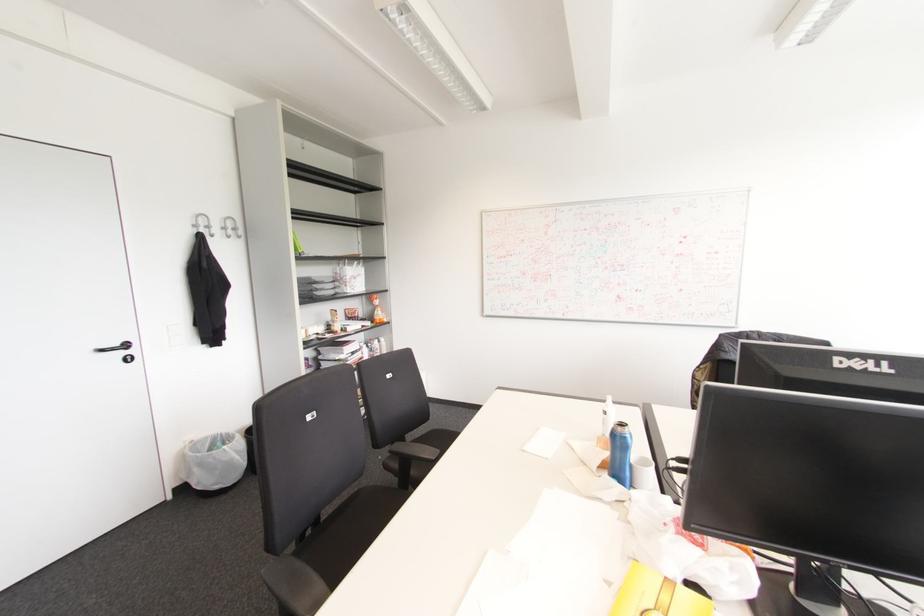
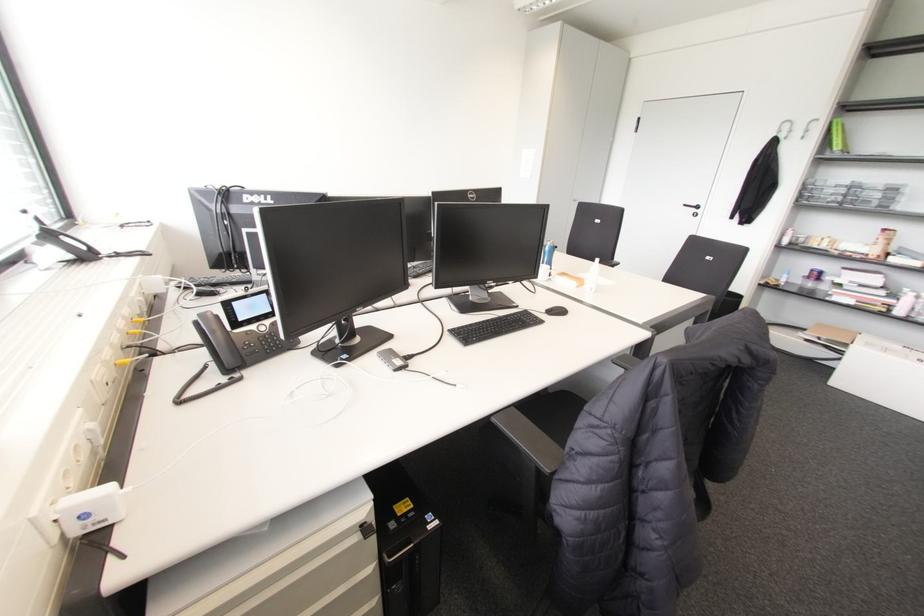
Question: I am providing you with two images of the same scene from different viewpoints. After the viewpoint changes to image2, which objects are now occluded?

Choices:
 (A) black computer mouse
 (B) white device handle
 (C) chair sitting surface
 (D) black keyboard

Answer: (C)